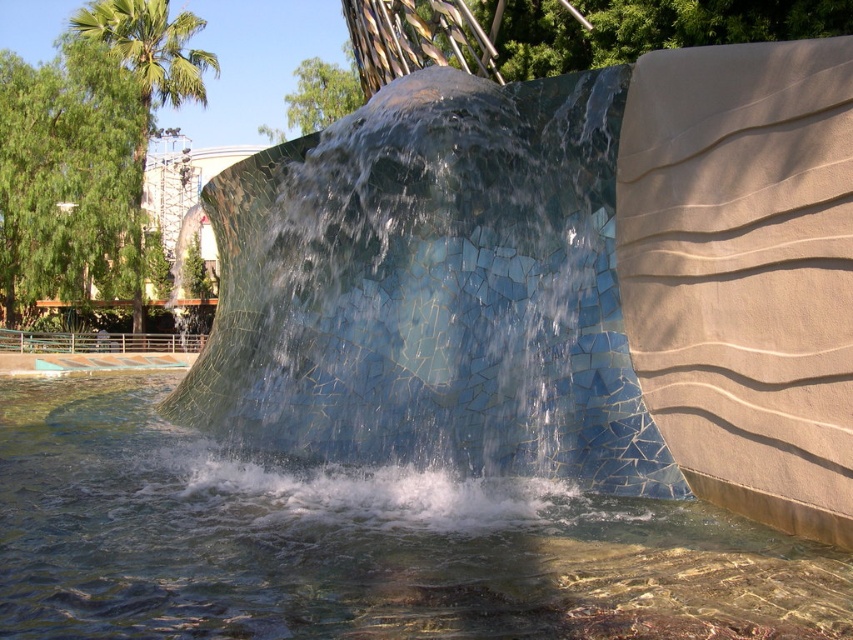
Can you confirm if blue mosaic wall at center is positioned below translucent glass water at center?

No, blue mosaic wall at center is not below translucent glass water at center.

You are a GUI agent. You are given a task and a screenshot of the screen. Output one action in this format:
    pyautogui.click(x=<x>, y=<y>)
    Task: Click on the blue mosaic wall at center
    This screenshot has height=640, width=853.
    Given the screenshot: What is the action you would take?
    pyautogui.click(x=432, y=289)

At what (x,y) coordinates should I click in order to perform the action: click on blue mosaic wall at center. Please return your answer as a coordinate pair (x, y). The image size is (853, 640). Looking at the image, I should click on (432, 289).

Consider the image. Between blue mosaic wall at center and green leafy palm tree at upper left, which one appears on the left side from the viewer's perspective?

green leafy palm tree at upper left is more to the left.

Is blue mosaic wall at center below green leafy palm tree at upper left?

Yes.

Locate an element on the screen. This screenshot has width=853, height=640. blue mosaic wall at center is located at coordinates (432, 289).

Identify the location of blue mosaic wall at center. Image resolution: width=853 pixels, height=640 pixels. (432, 289).

From the picture: Does translucent glass water at center have a lesser height compared to green leafy palm tree at upper left?

Indeed, translucent glass water at center has a lesser height compared to green leafy palm tree at upper left.

Does point (378, 496) lie in front of point (129, 36)?

Yes, point (378, 496) is closer to viewer.

Where is `translucent glass water at center`? Image resolution: width=853 pixels, height=640 pixels. translucent glass water at center is located at coordinates (357, 544).